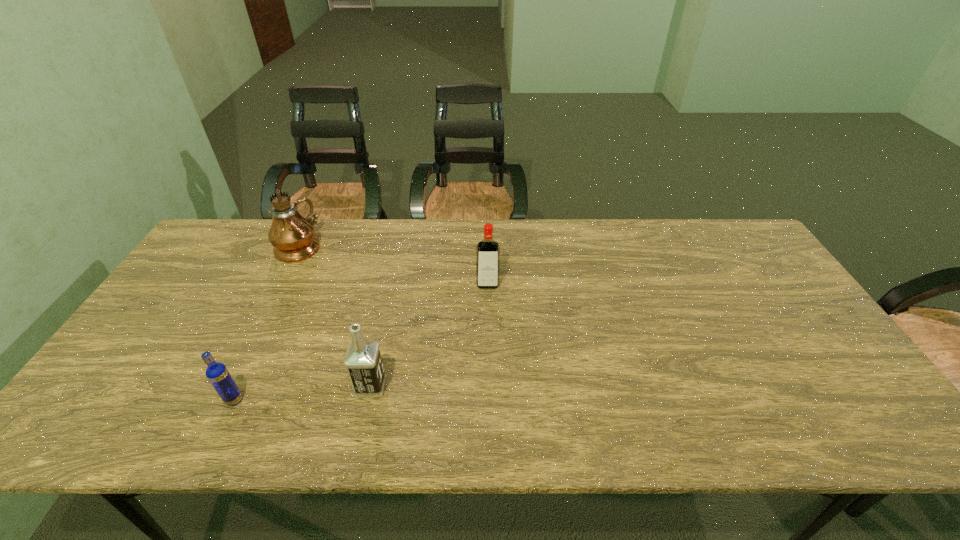
At what (x,y) coordinates should I click in order to perform the action: click on empty space between the second object from right to left and the shortest object. Please return your answer as a coordinate pair (x, y). The width and height of the screenshot is (960, 540). Looking at the image, I should click on (302, 393).

Where is `vacant space that's between the shortest object and the second vodka from right to left`? The height and width of the screenshot is (540, 960). vacant space that's between the shortest object and the second vodka from right to left is located at coordinates (302, 393).

The height and width of the screenshot is (540, 960). What are the coordinates of `vacant area that lies between the tallest object and the rightmost object` in the screenshot? It's located at [393, 265].

This screenshot has height=540, width=960. I want to click on unoccupied area between the rightmost object and the second vodka from left to right, so click(x=429, y=335).

Locate an element on the screen. Image resolution: width=960 pixels, height=540 pixels. vacant space in between the leftmost vodka and the farthest object is located at coordinates (267, 323).

The image size is (960, 540). Identify the location of free space between the leftmost vodka and the tallest object. (267, 323).

The image size is (960, 540). I want to click on vacant point located between the shortest object and the second vodka from left to right, so click(302, 393).

Find the location of `object that ranks as the third closest to the leftmost vodka`. object that ranks as the third closest to the leftmost vodka is located at coordinates (488, 250).

Locate an element on the screen. This screenshot has width=960, height=540. object that can be found as the second closest to the rightmost vodka is located at coordinates (293, 237).

I want to click on vodka that can be found as the second closest to the shortest object, so click(x=488, y=250).